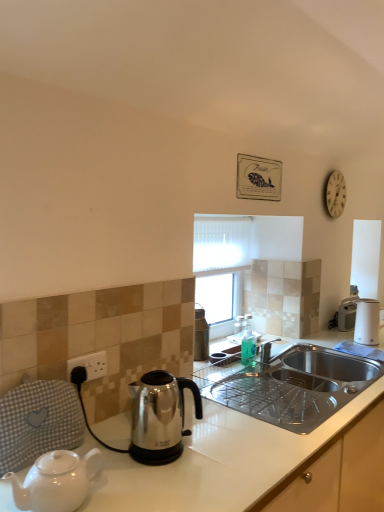
Question: Is white glossy countertop at lower right at the left side of black plastic power outlet at lower left?

Choices:
 (A) no
 (B) yes

Answer: (A)

Question: Does white glossy countertop at lower right have a lesser height compared to black plastic power outlet at lower left?

Choices:
 (A) yes
 (B) no

Answer: (B)

Question: Can you confirm if white glossy countertop at lower right is bigger than black plastic power outlet at lower left?

Choices:
 (A) yes
 (B) no

Answer: (A)

Question: Does white glossy countertop at lower right have a lesser width compared to black plastic power outlet at lower left?

Choices:
 (A) no
 (B) yes

Answer: (A)

Question: From the image's perspective, does white glossy countertop at lower right appear lower than black plastic power outlet at lower left?

Choices:
 (A) no
 (B) yes

Answer: (B)

Question: Considering the positions of stainless steel kettle at center, the first kettle positioned from the right, and satin silver kettle at left, which appears as the 1th kettle when viewed from the left, in the image, is stainless steel kettle at center, the first kettle positioned from the right, taller or shorter than satin silver kettle at left, which appears as the 1th kettle when viewed from the left,?

Choices:
 (A) tall
 (B) short

Answer: (A)

Question: From a real-world perspective, relative to satin silver kettle at left, marked as the 2th kettle in a back-to-front arrangement, is stainless steel kettle at center, which is the second kettle from front to back, vertically above or below?

Choices:
 (A) above
 (B) below

Answer: (A)

Question: Looking at their shapes, would you say stainless steel kettle at center, which is the second kettle from front to back, is wider or thinner than satin silver kettle at left, which appears as the 1th kettle when viewed from the left?

Choices:
 (A) wide
 (B) thin

Answer: (B)

Question: Choose the correct answer: Is stainless steel kettle at center, the first kettle positioned from the right, inside satin silver kettle at left, the first kettle when ordered from front to back, or outside it?

Choices:
 (A) inside
 (B) outside

Answer: (B)

Question: Considering the positions of white fabric at center and gray checkered blanket at lower left in the image, is white fabric at center wider or thinner than gray checkered blanket at lower left?

Choices:
 (A) thin
 (B) wide

Answer: (A)

Question: In the image, is white fabric at center positioned in front of or behind gray checkered blanket at lower left?

Choices:
 (A) behind
 (B) front

Answer: (A)

Question: From a real-world perspective, is white fabric at center above or below gray checkered blanket at lower left?

Choices:
 (A) above
 (B) below

Answer: (A)

Question: Which is correct: white fabric at center is inside gray checkered blanket at lower left, or outside of it?

Choices:
 (A) outside
 (B) inside

Answer: (A)

Question: Based on their sizes in the image, would you say black plastic power outlet at lower left is bigger or smaller than white fabric at center?

Choices:
 (A) small
 (B) big

Answer: (A)

Question: Considering the positions of black plastic power outlet at lower left and white fabric at center in the image, is black plastic power outlet at lower left wider or thinner than white fabric at center?

Choices:
 (A) thin
 (B) wide

Answer: (A)